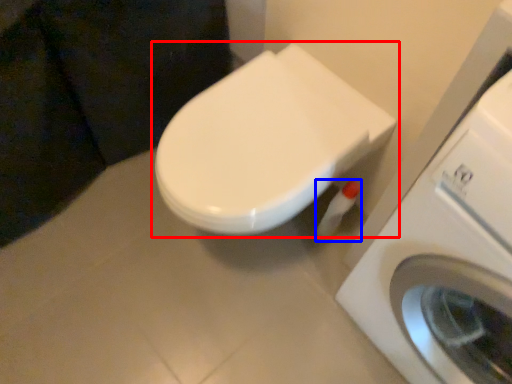
Question: Which of the following is the closest to the observer, toilet (highlighted by a red box) or toilet paper (highlighted by a blue box)?

Choices:
 (A) toilet
 (B) toilet paper

Answer: (A)